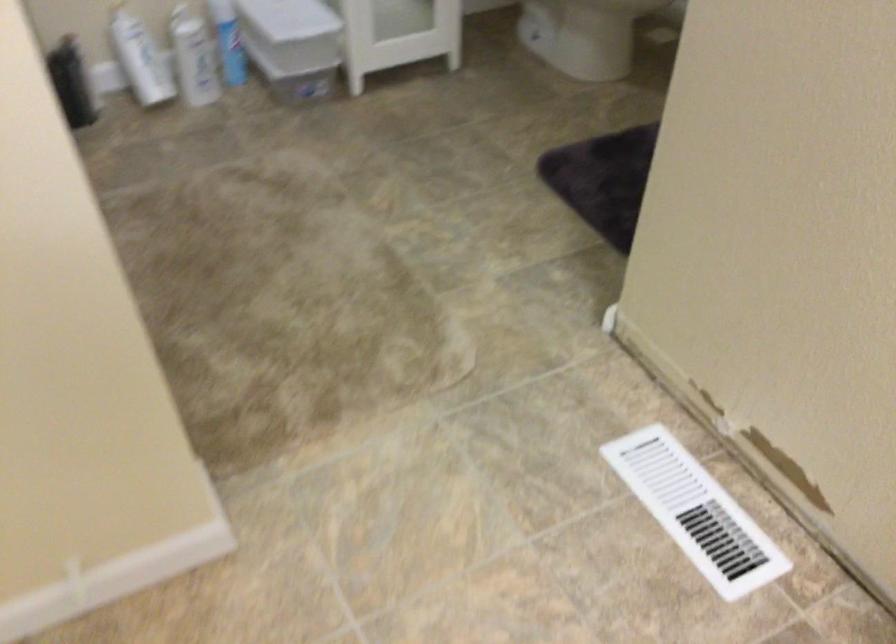
The height and width of the screenshot is (644, 896). Identify the location of black bottle. (72, 82).